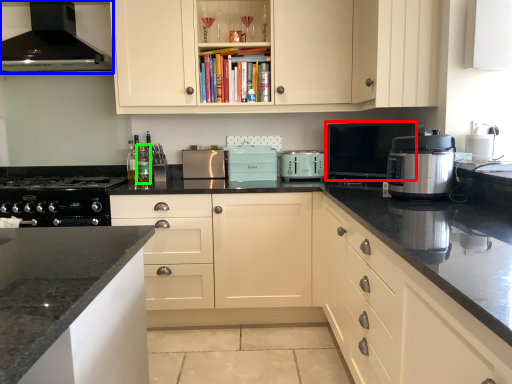
Question: Considering the real-world distances, which object is closest to kitchen appliance (highlighted by a red box)? home appliance (highlighted by a blue box) or bottle (highlighted by a green box).

Choices:
 (A) home appliance
 (B) bottle

Answer: (B)